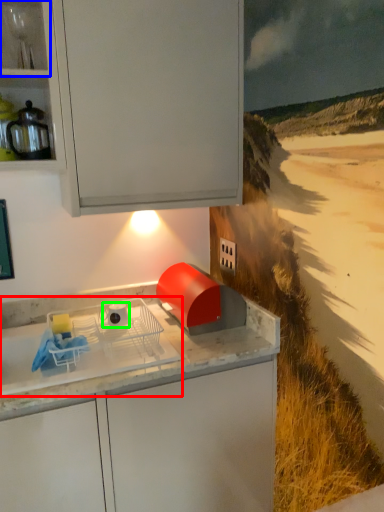
Question: Considering the real-world distances, which object is closest to home appliance (highlighted by a red box)? shelf (highlighted by a blue box) or appliance (highlighted by a green box).

Choices:
 (A) shelf
 (B) appliance

Answer: (B)